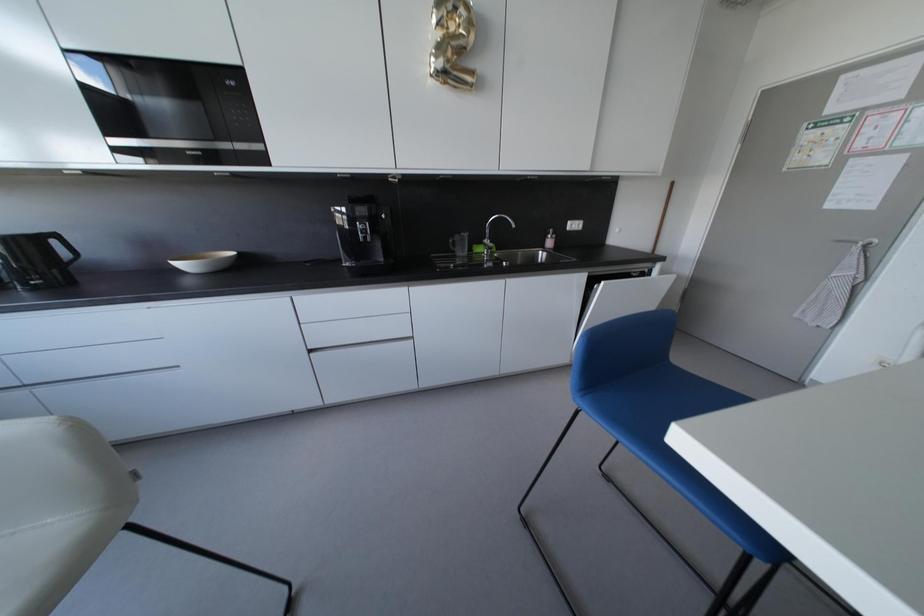
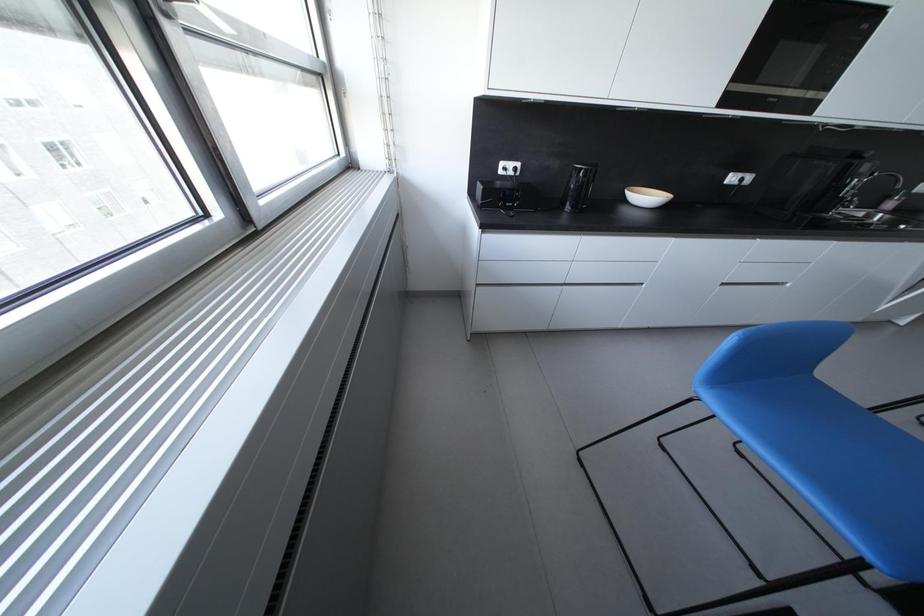
Question: The images are taken continuously from a first-person perspective. In which direction are you moving?

Choices:
 (A) Left
 (B) Right
 (C) Forward
 (D) Backward

Answer: (A)